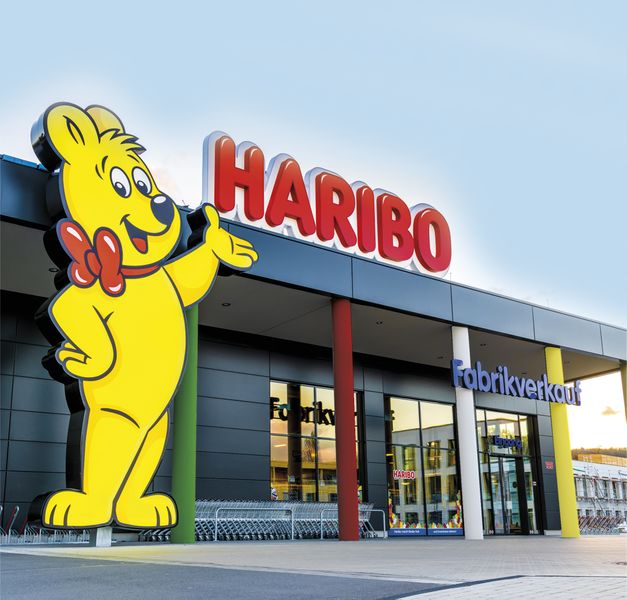
Where is `red pillar`? The image size is (627, 600). red pillar is located at coordinates (345, 490).